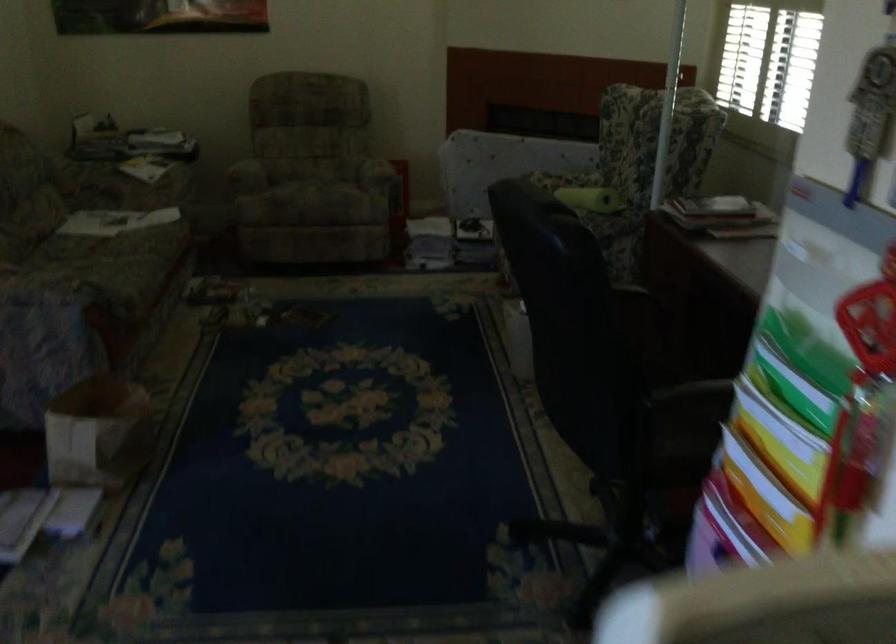
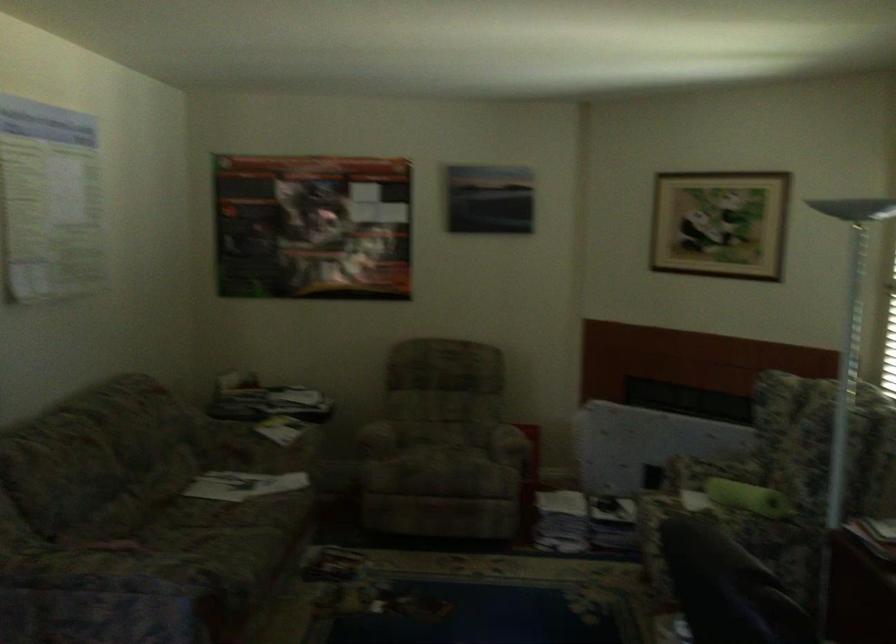
Where in the second image is the point corresponding to (302,178) from the first image?

(436, 451)